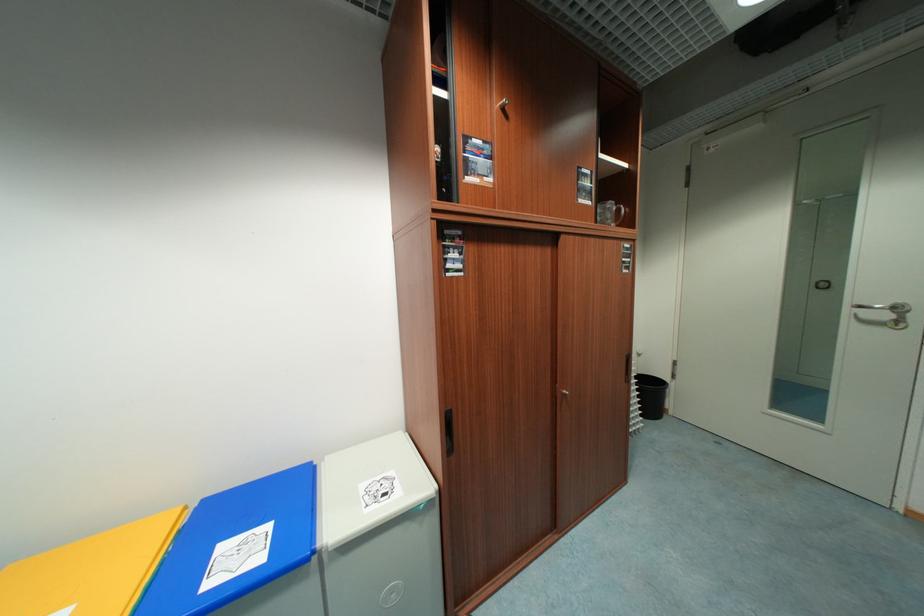
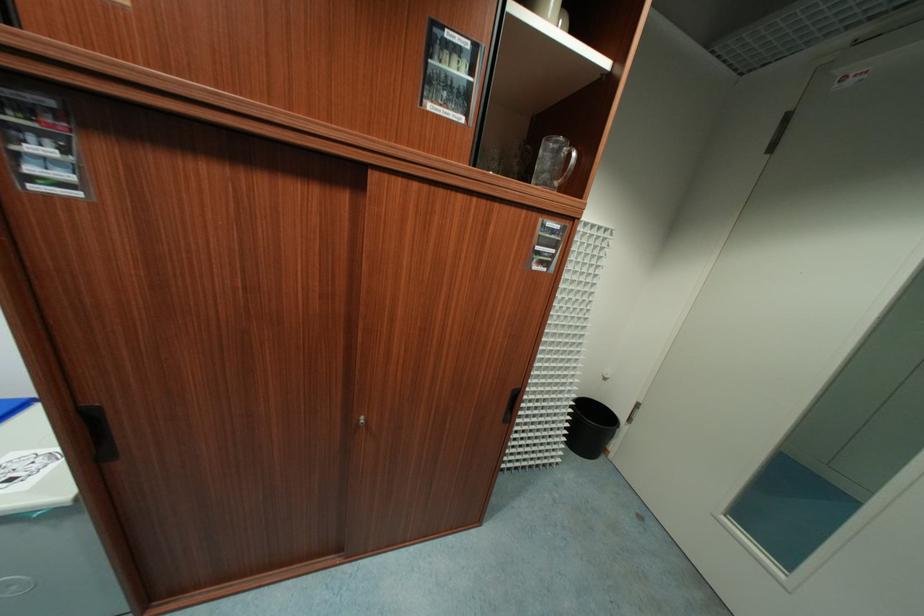
In a continuous first-person perspective shot, in which direction is the camera moving?

The cameraman moved toward right, forward.